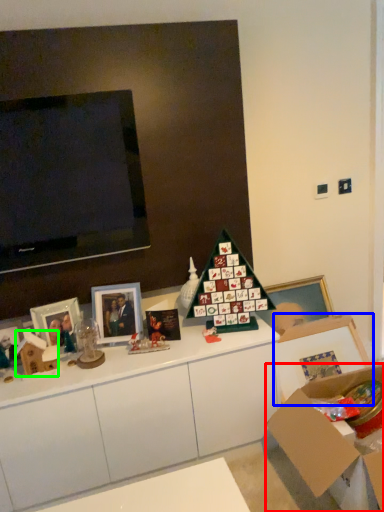
Question: Which object is the farthest from cardboard box (highlighted by a red box)? Choose among these: picture frame (highlighted by a blue box) or box (highlighted by a green box).

Choices:
 (A) picture frame
 (B) box

Answer: (B)